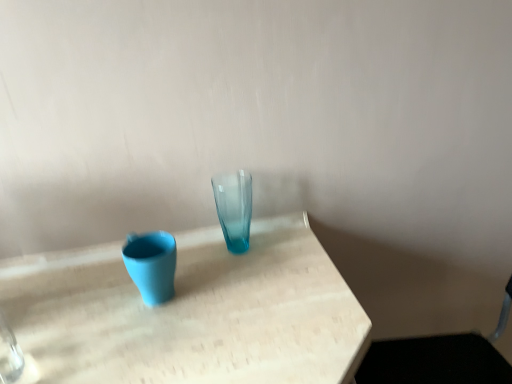
Question: Is metallic silver swivel chair at lower right behind translucent glass vase at center, the 1th vase in the right-to-left sequence?

Choices:
 (A) yes
 (B) no

Answer: (B)

Question: Does metallic silver swivel chair at lower right have a greater width compared to translucent glass vase at center, the 1th vase in the right-to-left sequence?

Choices:
 (A) yes
 (B) no

Answer: (A)

Question: Can you confirm if metallic silver swivel chair at lower right is smaller than translucent glass vase at center, marked as the 2th vase in a left-to-right arrangement?

Choices:
 (A) no
 (B) yes

Answer: (A)

Question: From the image's perspective, is metallic silver swivel chair at lower right located above translucent glass vase at center, marked as the 2th vase in a left-to-right arrangement?

Choices:
 (A) yes
 (B) no

Answer: (B)

Question: From a real-world perspective, is metallic silver swivel chair at lower right beneath translucent glass vase at center, marked as the 2th vase in a left-to-right arrangement?

Choices:
 (A) yes
 (B) no

Answer: (A)

Question: Is metallic silver swivel chair at lower right to the left or to the right of translucent glass vase at center, the 1th vase in the right-to-left sequence, in the image?

Choices:
 (A) left
 (B) right

Answer: (B)

Question: In terms of height, does metallic silver swivel chair at lower right look taller or shorter compared to translucent glass vase at center, the 1th vase in the right-to-left sequence?

Choices:
 (A) short
 (B) tall

Answer: (B)

Question: Relative to translucent glass vase at center, marked as the 2th vase in a left-to-right arrangement, is metallic silver swivel chair at lower right in front or behind?

Choices:
 (A) behind
 (B) front

Answer: (B)

Question: Considering the positions of metallic silver swivel chair at lower right and translucent glass vase at center, marked as the 2th vase in a left-to-right arrangement, in the image, is metallic silver swivel chair at lower right bigger or smaller than translucent glass vase at center, marked as the 2th vase in a left-to-right arrangement,?

Choices:
 (A) big
 (B) small

Answer: (A)

Question: Considering the positions of matte blue vase at left, the 1th vase from the left, and translucent glass vase at center, the 1th vase in the right-to-left sequence, in the image, is matte blue vase at left, the 1th vase from the left, wider or thinner than translucent glass vase at center, the 1th vase in the right-to-left sequence,?

Choices:
 (A) wide
 (B) thin

Answer: (A)

Question: Do you think matte blue vase at left, the 1th vase from the left, is within translucent glass vase at center, the 1th vase in the right-to-left sequence, or outside of it?

Choices:
 (A) inside
 (B) outside

Answer: (B)

Question: From a real-world perspective, relative to translucent glass vase at center, marked as the 2th vase in a left-to-right arrangement, is matte blue vase at left, the 1th vase from the left, vertically above or below?

Choices:
 (A) above
 (B) below

Answer: (B)

Question: From the image's perspective, is matte blue vase at left, the 1th vase from the left, positioned above or below translucent glass vase at center, the 1th vase in the right-to-left sequence?

Choices:
 (A) below
 (B) above

Answer: (A)

Question: Is translucent glass vase at center, the 1th vase in the right-to-left sequence, spatially inside metallic silver swivel chair at lower right, or outside of it?

Choices:
 (A) inside
 (B) outside

Answer: (B)

Question: Considering the relative positions of translucent glass vase at center, the 1th vase in the right-to-left sequence, and metallic silver swivel chair at lower right in the image provided, is translucent glass vase at center, the 1th vase in the right-to-left sequence, to the left or to the right of metallic silver swivel chair at lower right?

Choices:
 (A) left
 (B) right

Answer: (A)